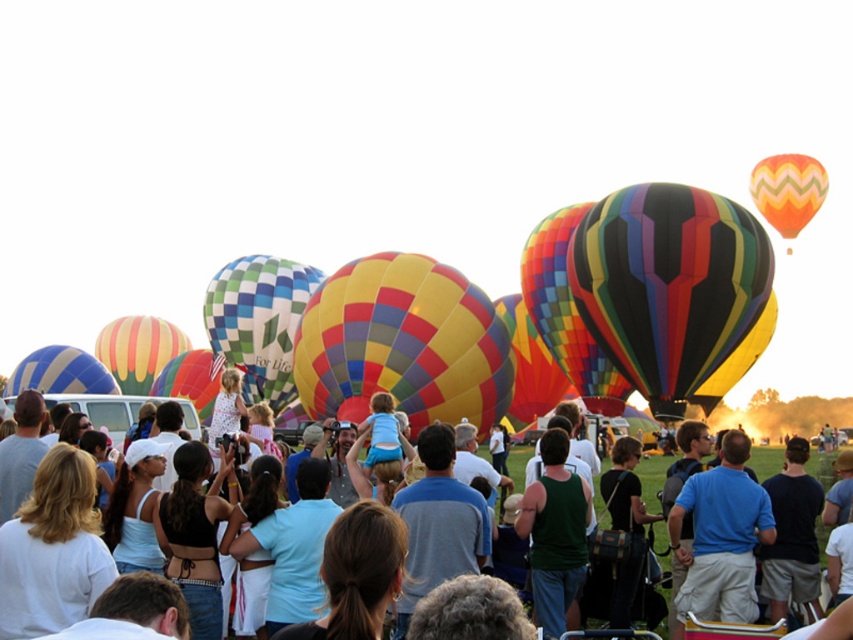
Is multicolored fabric hot air balloon at center to the left of multicolored striped fabric hot air balloon at center from the viewer's perspective?

Indeed, multicolored fabric hot air balloon at center is positioned on the left side of multicolored striped fabric hot air balloon at center.

Consider the image. Can you confirm if multicolored fabric hot air balloon at center is thinner than multicolored striped fabric hot air balloon at center?

Incorrect, multicolored fabric hot air balloon at center's width is not less than multicolored striped fabric hot air balloon at center's.

Does point (757, 394) come closer to viewer compared to point (682, 296)?

No.

This screenshot has width=853, height=640. I want to click on multicolored fabric hot air balloon at center, so click(323, 349).

Can you confirm if multicolored striped fabric hot air balloon at center is thinner than matte multicolored balloons at center?

Correct, multicolored striped fabric hot air balloon at center's width is less than matte multicolored balloons at center's.

Between multicolored striped fabric hot air balloon at center and matte multicolored balloons at center, which one is positioned higher?

multicolored striped fabric hot air balloon at center

Who is more distant from viewer, (688, 252) or (775, 464)?

The point (775, 464) is more distant.

Locate an element on the screen. This screenshot has height=640, width=853. multicolored striped fabric hot air balloon at center is located at coordinates (672, 291).

Who is lower down, multicolored striped fabric hot air balloon at center or yellow and red striped fabric hot air balloon at center?

yellow and red striped fabric hot air balloon at center is below.

Is multicolored striped fabric hot air balloon at center smaller than yellow and red striped fabric hot air balloon at center?

No, multicolored striped fabric hot air balloon at center is not smaller than yellow and red striped fabric hot air balloon at center.

Does point (670, 305) lie in front of point (364, 326)?

Yes, it is.

The height and width of the screenshot is (640, 853). Find the location of `multicolored striped fabric hot air balloon at center`. multicolored striped fabric hot air balloon at center is located at coordinates (672, 291).